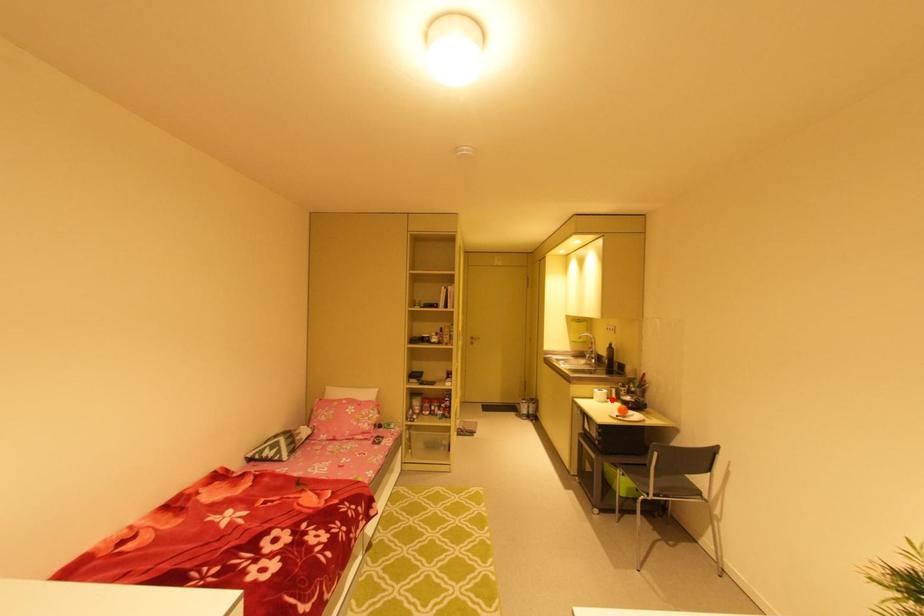
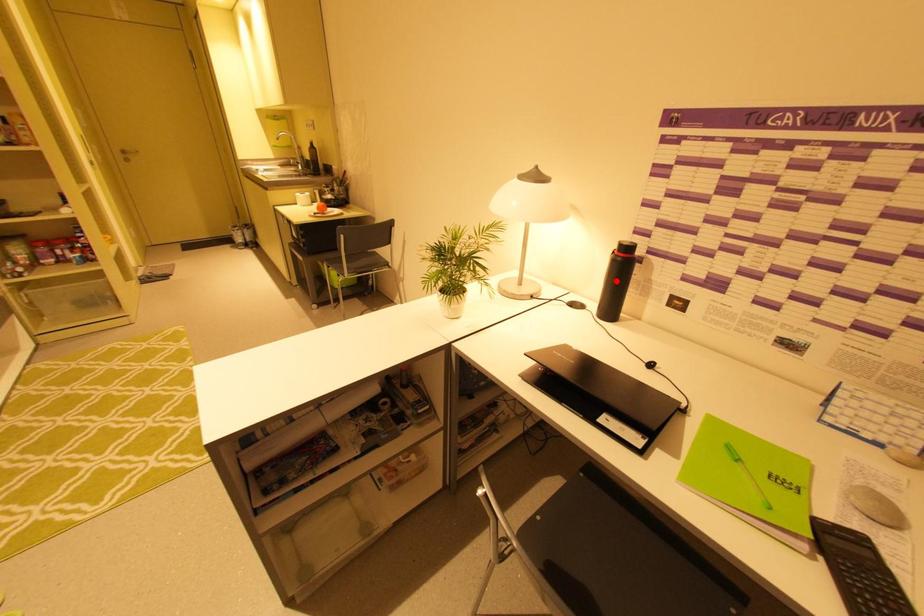
I am providing you with two images of the same scene from different viewpoints. A red point is marked on the first image and another point is marked on the second image. Are the points marked in image1 and image2 representing the same 3D position?

No